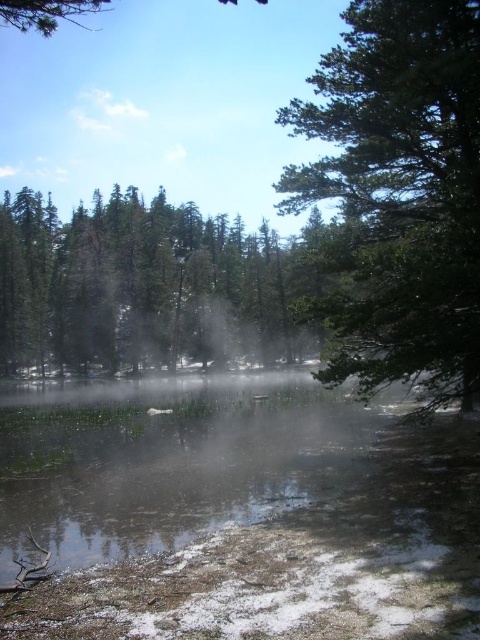
You are an artist trying to paint the scene. You want to ensure the green textured tree at upper right and the green matte trees at center are proportionally accurate. Which of the two has a smaller width?

The green textured tree at upper right has a smaller width than the green matte trees at center.